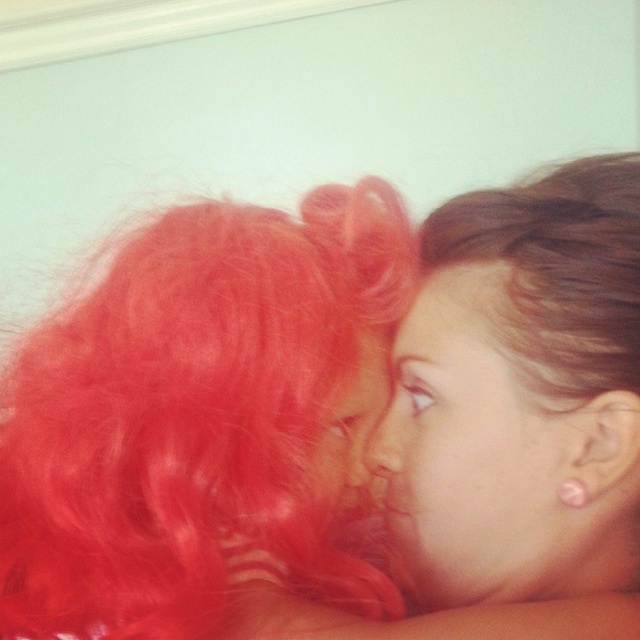
You are a photographer adjusting the camera focus. The bright red hair at center and the smooth skin face at center are both in the frame. Which object should you focus on first if you want to ensure the subject with the larger size is sharp?

The bright red hair at center is much taller than the smooth skin face at center, so you should focus on the bright red hair at center first to ensure the larger subject is sharp.

You are a photographer setting up for a portrait session. You have a camera with a lens that can focus on objects within 2 inches. You notice the smooth skin face at center and the matte red hair at center in the scene. Can your camera capture both subjects in focus simultaneously?

The distance between the smooth skin face at center and the matte red hair at center is 1.99 inches, which is within the camera lens focus range of 2 inches. Therefore, the camera can capture both subjects in focus simultaneously.

The scene shows a mother and child in a room with a light blue wall. There is a point marked at coordinates [195,420]. What object or feature in the image is located at this point?

The bright red hair at center is located at point [195,420].